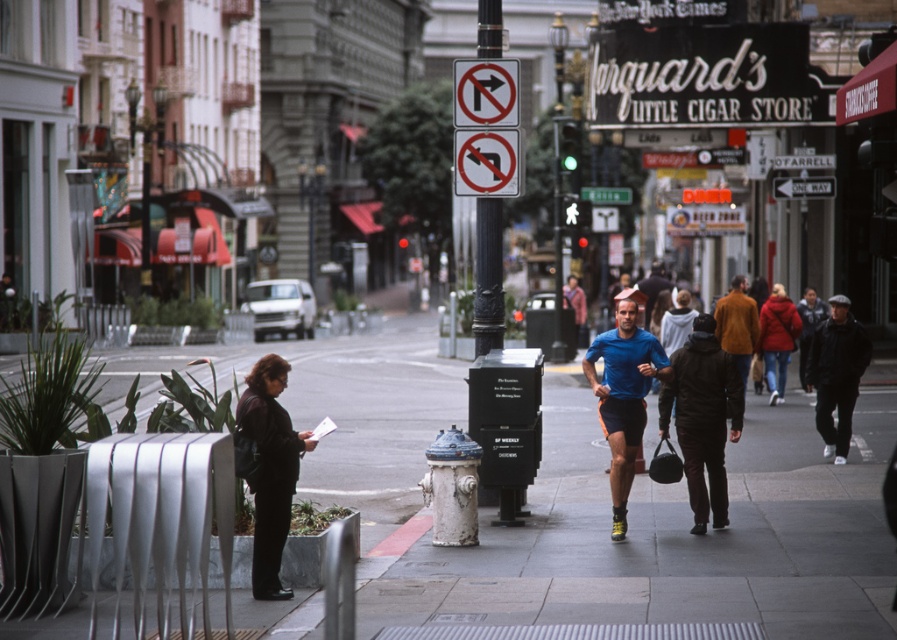
You are standing at the edge of the sidewalk and see a black leather jacket at lower left and a smooth concrete sidewalk at center. Which object is closer to your current position?

The black leather jacket at lower left is closer to your current position because it is positioned to the left of the smooth concrete sidewalk at center.

You are standing on the smooth concrete sidewalk at center and want to pick up the black leather jacket at lower left. Is the jacket within your immediate reach without moving your feet?

The smooth concrete sidewalk at center is closer to the viewer than the black leather jacket at lower left, so the jacket is farther away. You would need to move your feet to reach it.